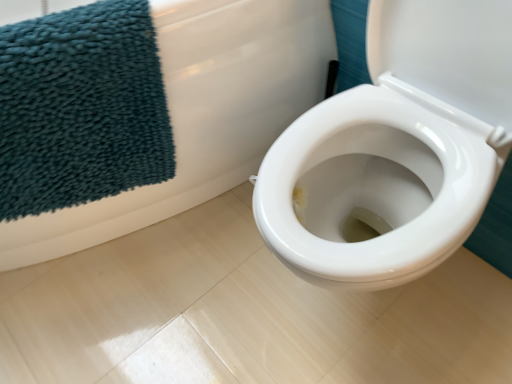
Question: Does teal plush towel at upper left appear on the right side of white glossy toilet at center right?

Choices:
 (A) no
 (B) yes

Answer: (B)

Question: From the image's perspective, is teal plush towel at upper left under white glossy toilet at center right?

Choices:
 (A) yes
 (B) no

Answer: (A)

Question: From the image's perspective, would you say teal plush towel at upper left is positioned over white glossy toilet at center right?

Choices:
 (A) yes
 (B) no

Answer: (B)

Question: Can you confirm if teal plush towel at upper left is shorter than white glossy toilet at center right?

Choices:
 (A) no
 (B) yes

Answer: (B)

Question: Is teal plush towel at upper left not inside white glossy toilet at center right?

Choices:
 (A) yes
 (B) no

Answer: (B)

Question: Would you say white glossy toilet at center right is part of teal plush towel at upper left's contents?

Choices:
 (A) no
 (B) yes

Answer: (A)

Question: Does white glossy toilet at center right have a larger size compared to teal plush towel at upper left?

Choices:
 (A) yes
 (B) no

Answer: (A)

Question: Is white glossy toilet at center right surrounding teal plush towel at upper left?

Choices:
 (A) no
 (B) yes

Answer: (B)

Question: Can you confirm if white glossy toilet at center right is positioned to the left of teal plush towel at upper left?

Choices:
 (A) yes
 (B) no

Answer: (A)

Question: Does white glossy toilet at center right have a greater height compared to teal plush towel at upper left?

Choices:
 (A) no
 (B) yes

Answer: (B)

Question: Can you confirm if white glossy toilet at center right is positioned to the right of teal plush towel at upper left?

Choices:
 (A) no
 (B) yes

Answer: (A)

Question: Can you confirm if white glossy toilet at center right is thinner than teal plush towel at upper left?

Choices:
 (A) yes
 (B) no

Answer: (B)

Question: Does point (254, 91) appear closer or farther from the camera than point (28, 213)?

Choices:
 (A) farther
 (B) closer

Answer: (A)